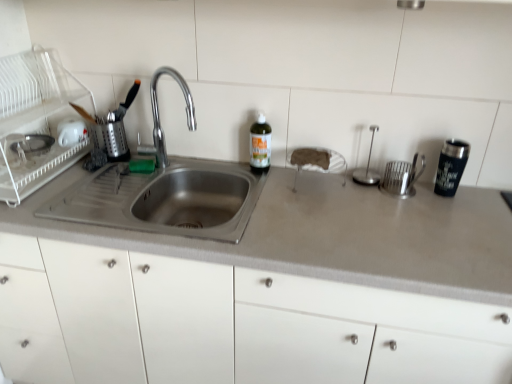
The height and width of the screenshot is (384, 512). Identify the location of free point to the left of white matte sponge at center, which is counted as the third appliance, starting from the left. (272, 184).